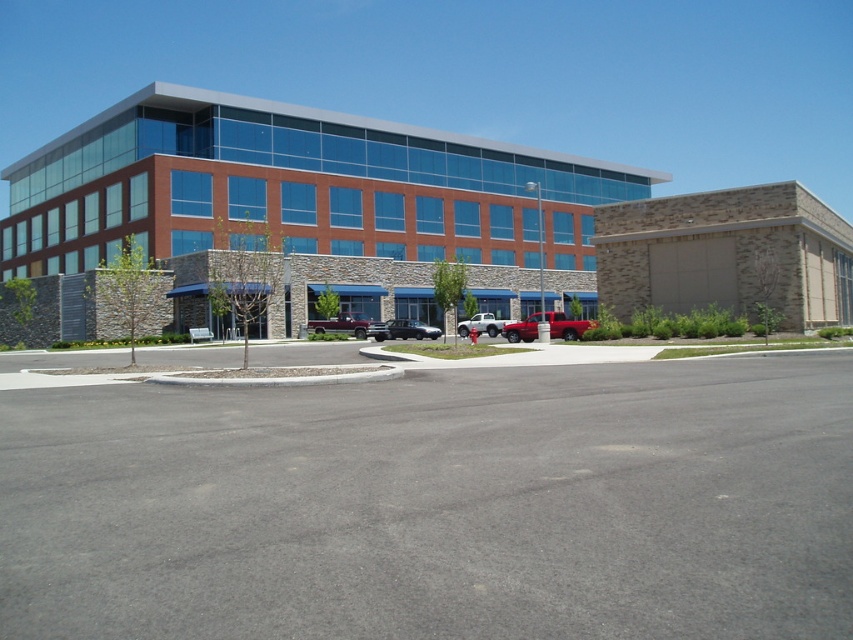
Question: Considering the real-world distances, which object is closest to the white matte truck at center?

Choices:
 (A) shiny black sedan at center
 (B) matte red truck at center
 (C) gray asphalt parking lot at center
 (D) metallic red truck at center

Answer: (D)

Question: Is matte red truck at center to the left of shiny black sedan at center from the viewer's perspective?

Choices:
 (A) no
 (B) yes

Answer: (B)

Question: Observing the image, what is the correct spatial positioning of gray asphalt parking lot at center in reference to shiny black sedan at center?

Choices:
 (A) below
 (B) above

Answer: (A)

Question: Which object is the closest to the gray asphalt parking lot at center?

Choices:
 (A) white matte truck at center
 (B) metallic red truck at center
 (C) shiny black sedan at center

Answer: (B)

Question: Which is nearer to the shiny black sedan at center?

Choices:
 (A) white matte truck at center
 (B) metallic red truck at center
 (C) gray asphalt parking lot at center

Answer: (A)

Question: Can you confirm if metallic red truck at center is bigger than white matte truck at center?

Choices:
 (A) yes
 (B) no

Answer: (A)